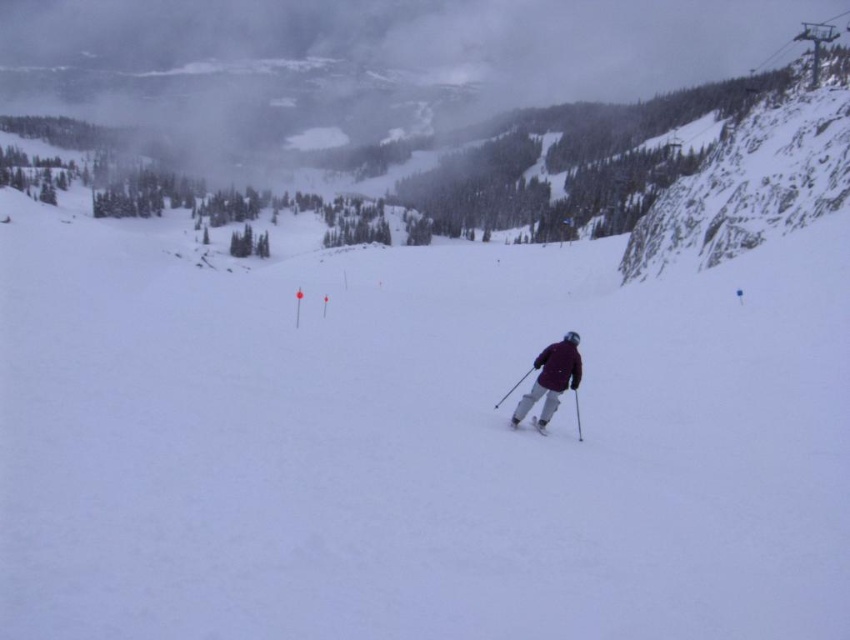
You are a drone operator trying to capture a photo of the skier and the point at coordinates point (575, 346). Your camera has a maximum zoom range of 100 feet. Can you capture both subjects in the same frame without moving the drone?

The distance between the skier and the point (575, 346) is 128.25 feet, which exceeds the camera maximum zoom range of 100 feet. Therefore, you cannot capture both subjects in the same frame without moving the drone.

You are a photographer aiming to capture the skier in the scene. Since you want to focus on the skier, which object should you adjust your camera to focus on first, the maroon fabric jacket at center or the matte gray ski at center?

The maroon fabric jacket at center is positioned over matte gray ski at center, so you should focus on the maroon fabric jacket at center first as it is closer to the camera.

You are a photographer trying to capture the skier in the image. If you want to ensure both the maroon fabric jacket at center and the matte gray ski at center are fully visible in your shot, which object should you focus on to frame the scene appropriately?

You should focus on the maroon fabric jacket at center because it might be wider than the matte gray ski at center, so ensuring the jacket is framed properly will automatically include the ski within the shot.